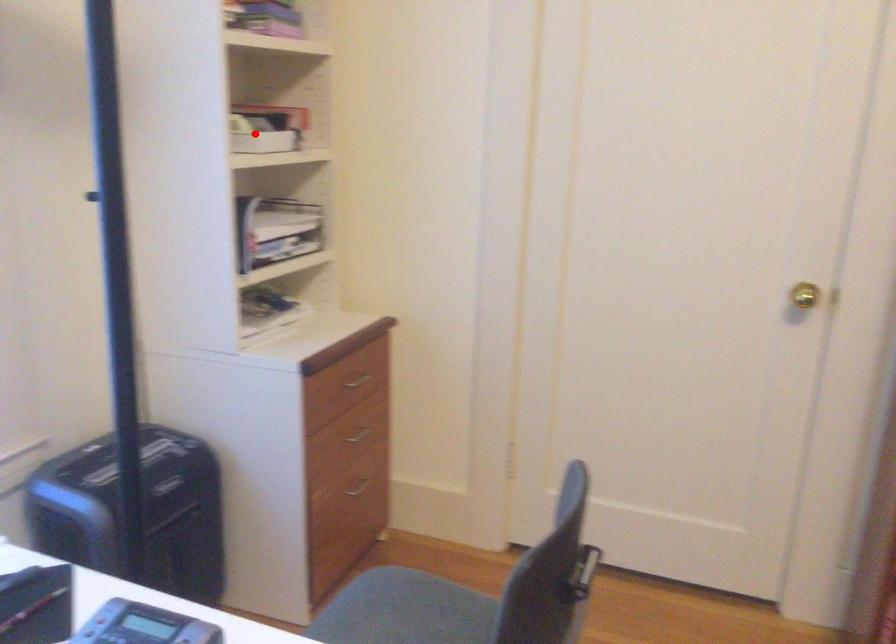
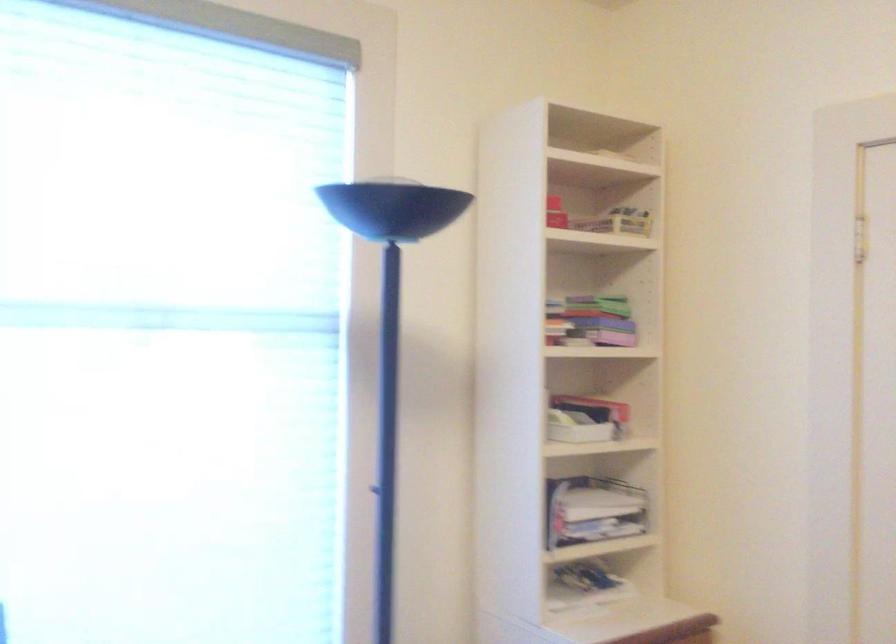
Find the pixel in the second image that matches the highlighted location in the first image.

(576, 428)